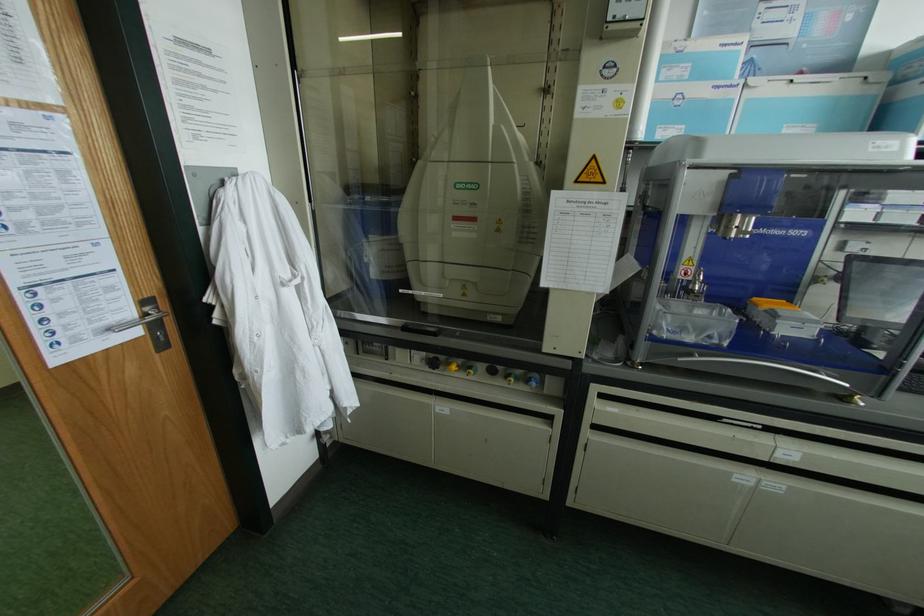
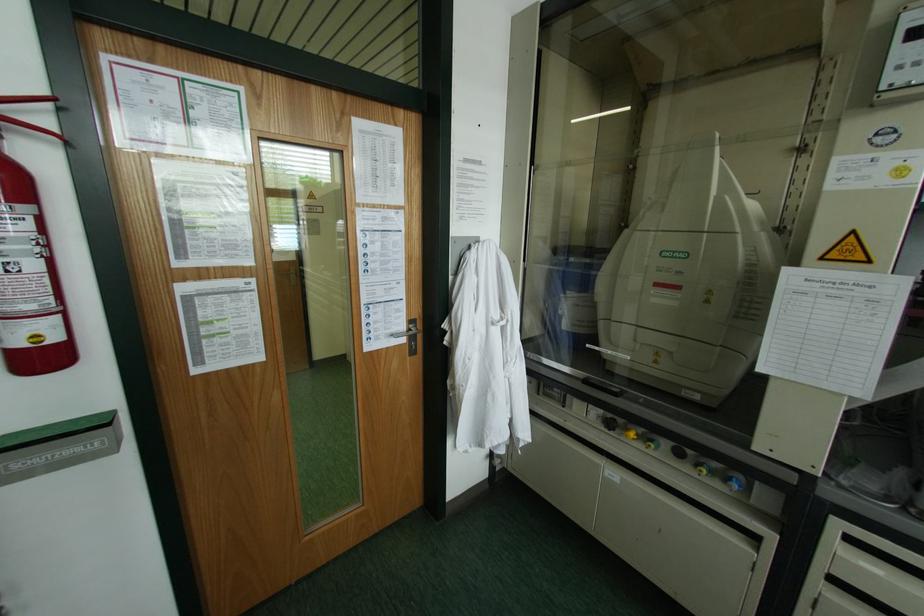
Where in the second image is the point corresponding to point (536, 376) from the first image?

(740, 477)